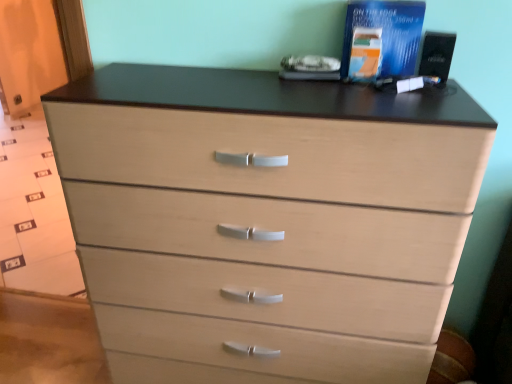
Where is `vacant space positioned to the left of blue matte book at upper right, the first book positioned from the right`? This screenshot has width=512, height=384. vacant space positioned to the left of blue matte book at upper right, the first book positioned from the right is located at coordinates click(307, 85).